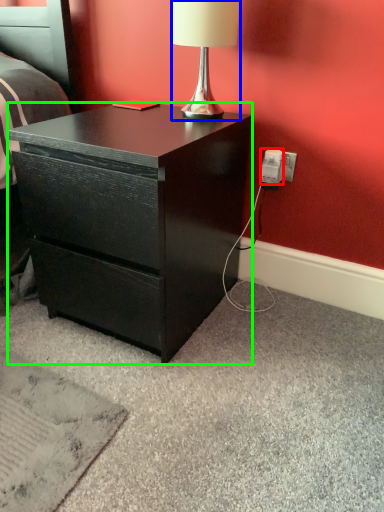
Question: Which object is positioned farthest from power outlet (highlighted by a red box)? Select from lamp (highlighted by a blue box) and desk (highlighted by a green box).

Choices:
 (A) lamp
 (B) desk

Answer: (B)